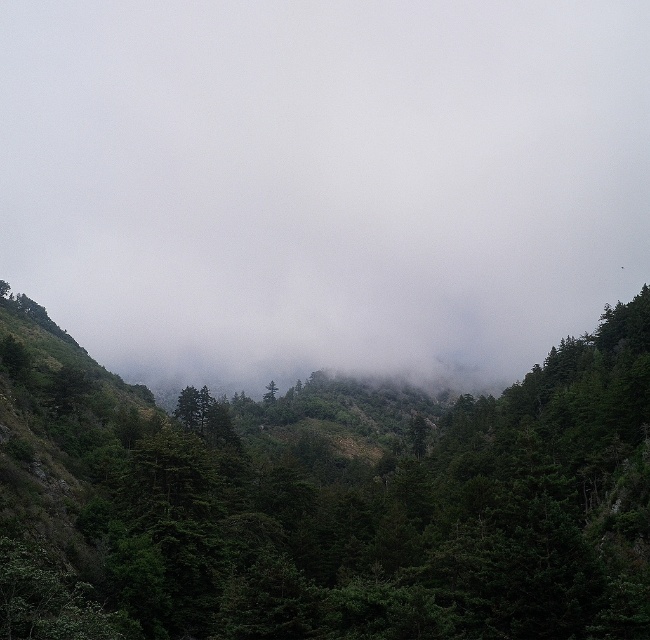
Does point (146, 381) come farther from viewer compared to point (341, 497)?

That is True.

Can you confirm if white foggy cloud at center is positioned to the right of green matte forest at center?

Yes, white foggy cloud at center is to the right of green matte forest at center.

Is point (534, 285) less distant than point (8, 394)?

That is False.

Locate an element on the screen. The height and width of the screenshot is (640, 650). white foggy cloud at center is located at coordinates (322, 182).